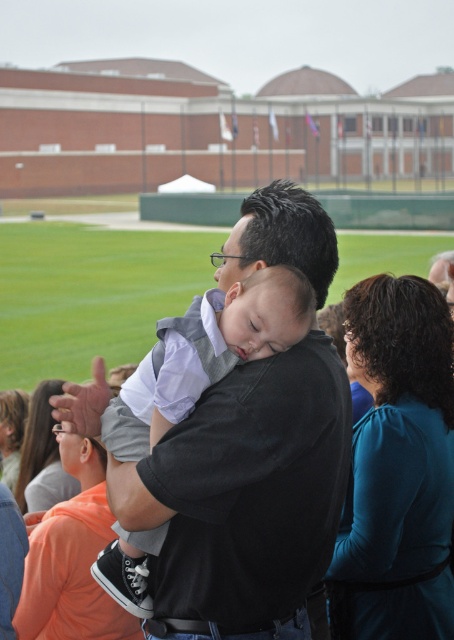
Question: Which point is farther to the camera?

Choices:
 (A) (230, 420)
 (B) (47, 506)
 (C) (384, 467)

Answer: (B)

Question: Is black cotton shirt at center below teal fabric dress at lower left?

Choices:
 (A) no
 (B) yes

Answer: (A)

Question: Is teal fabric shirt at lower left positioned at the back of teal fabric dress at lower left?

Choices:
 (A) no
 (B) yes

Answer: (A)

Question: Estimate the real-world distances between objects in this image. Which object is closer to the black cotton shirt at center?

Choices:
 (A) teal fabric shirt at right
 (B) teal fabric shirt at lower left

Answer: (A)

Question: Which object is closer to the camera taking this photo?

Choices:
 (A) black cotton shirt at center
 (B) teal fabric shirt at right
 (C) teal fabric dress at lower left

Answer: (A)

Question: Where is black cotton shirt at center located in relation to teal fabric shirt at right in the image?

Choices:
 (A) left
 (B) right

Answer: (A)